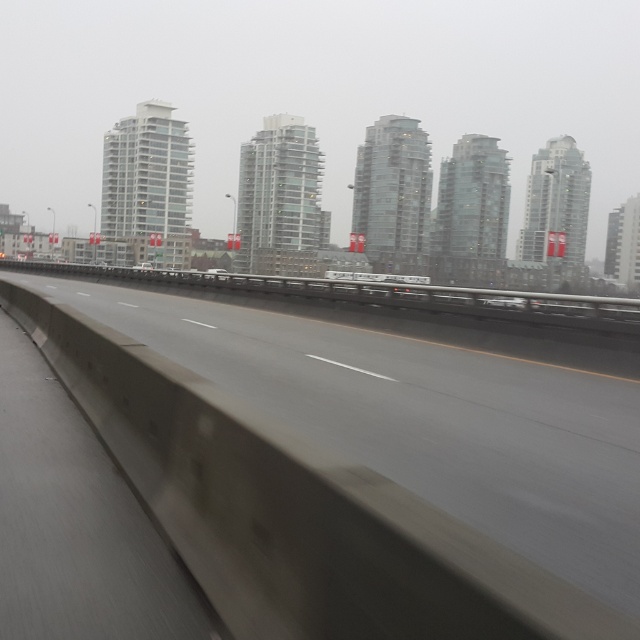
You are driving a white glossy car at center and want to park it near the concrete at center. Since the concrete is to the right of your car, which direction should you move to get closer to the concrete?

Since the concrete at center is to the right of the white glossy car at center, you should move to your right to get closer to the concrete.